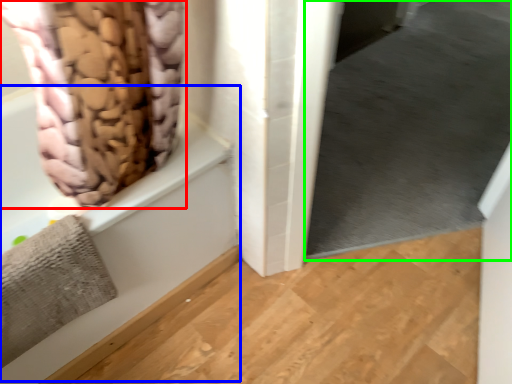
Question: Which is nearer to the curtain (highlighted by a red box)? bath (highlighted by a blue box) or window screen (highlighted by a green box).

Choices:
 (A) bath
 (B) window screen

Answer: (A)